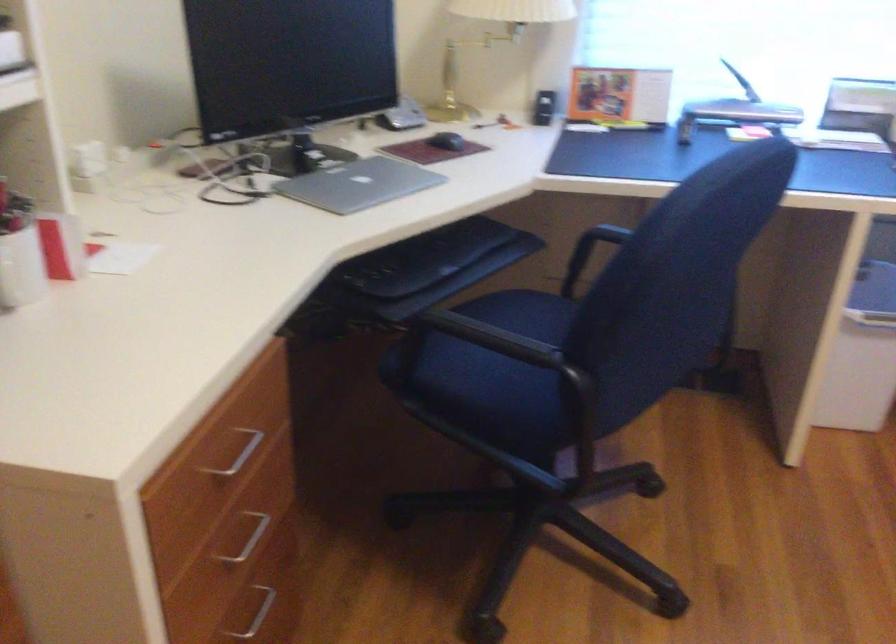
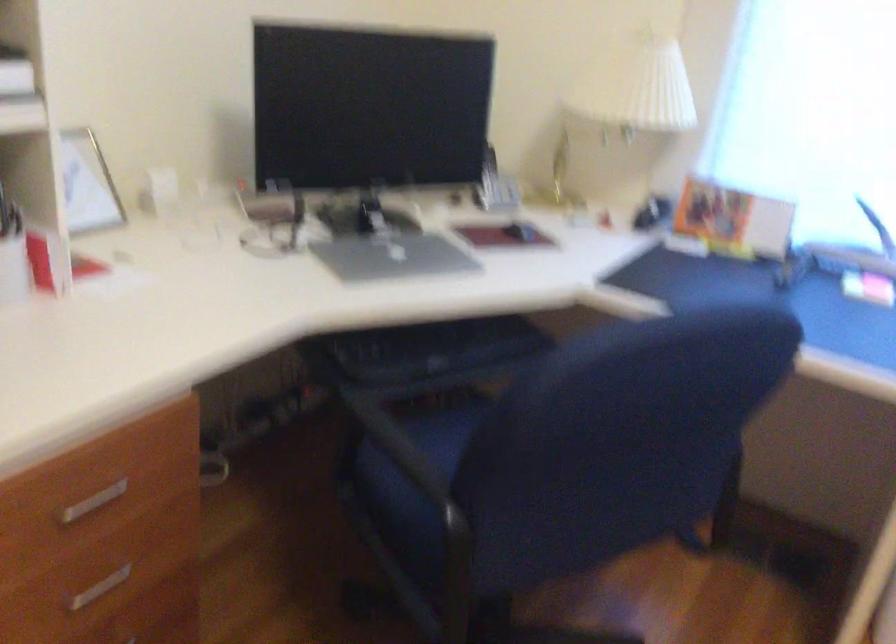
Question: The camera is either moving clockwise (left) or counter-clockwise (right) around the object. The first image is from the beginning of the video and the second image is from the end. Is the camera moving left or right when shooting the video?

Choices:
 (A) Left
 (B) Right

Answer: (B)